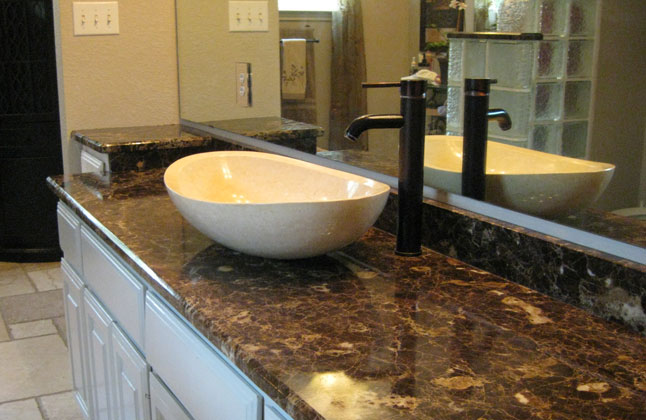
Image resolution: width=646 pixels, height=420 pixels. Find the location of `light switch cover`. light switch cover is located at coordinates (97, 11).